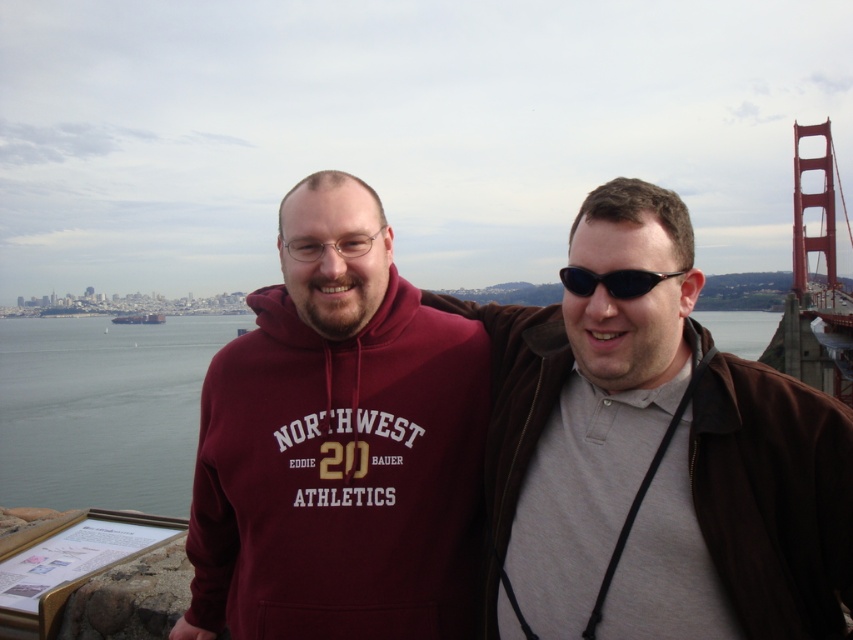
You are a photographer planning to take a group photo of the two people in the scene. The minimum distance required between subjects for your camera to focus properly is 5 meters. Based on the scene, will the distance between the brown leather jacket at right and the maroon hoodie at center allow for proper focus?

The brown leather jacket at right and the maroon hoodie at center are 6.46 meters apart, which exceeds the 5 meter minimum distance required for proper focus. Therefore, the camera should be able to focus properly on both subjects.

You are a photographer setting up a shot of the two people in the scene. You need to ensure that both the brown leather jacket at right and the black plastic goggles at center are clearly visible. Given their sizes, which object might require more careful framing to avoid being too small in the photo?

The black plastic goggles at center are smaller than the brown leather jacket at right, so they might require more careful framing to avoid being too small in the photo.